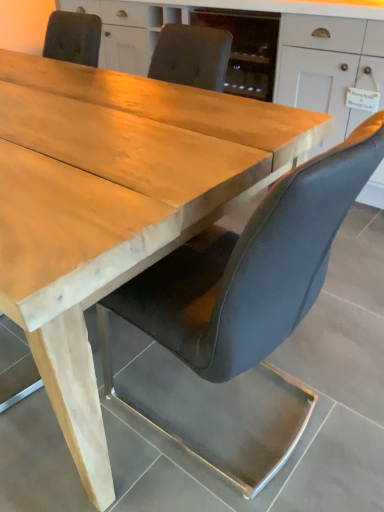
Consider the image. Measure the distance between point (286, 322) and camera.

The distance of point (286, 322) from camera is 92.40 centimeters.

This screenshot has width=384, height=512. Describe the element at coordinates (240, 285) in the screenshot. I see `leather-like black chair at center` at that location.

The height and width of the screenshot is (512, 384). In order to click on leather-like black chair at center in this screenshot , I will do `click(240, 285)`.

Where is `matte white cabinet at upper center`? This screenshot has width=384, height=512. matte white cabinet at upper center is located at coordinates (327, 67).

The height and width of the screenshot is (512, 384). What do you see at coordinates (327, 67) in the screenshot?
I see `matte white cabinet at upper center` at bounding box center [327, 67].

Locate an element on the screen. Image resolution: width=384 pixels, height=512 pixels. leather-like black chair at center is located at coordinates (240, 285).

Considering the relative positions of matte white cabinet at upper center and leather-like black chair at center in the image provided, is matte white cabinet at upper center to the right of leather-like black chair at center from the viewer's perspective?

Indeed, matte white cabinet at upper center is positioned on the right side of leather-like black chair at center.

Which is behind, matte white cabinet at upper center or leather-like black chair at center?

matte white cabinet at upper center is behind.

Does point (299, 55) lie in front of point (176, 266)?

That is False.

From the image's perspective, is matte white cabinet at upper center located beneath leather-like black chair at center?

Incorrect, from the image's perspective, matte white cabinet at upper center is higher than leather-like black chair at center.

From a real-world perspective, which is physically below, matte white cabinet at upper center or leather-like black chair at center?

In real-world perspective, leather-like black chair at center is lower.

Which object is wider, matte white cabinet at upper center or leather-like black chair at center?

matte white cabinet at upper center is wider.

Does matte white cabinet at upper center have a lesser height compared to leather-like black chair at center?

Incorrect, the height of matte white cabinet at upper center does not fall short of that of leather-like black chair at center.

Considering the sizes of objects matte white cabinet at upper center and leather-like black chair at center in the image provided, who is smaller, matte white cabinet at upper center or leather-like black chair at center?

With smaller size is leather-like black chair at center.

Would you say matte white cabinet at upper center is outside leather-like black chair at center?

That's correct, matte white cabinet at upper center is outside of leather-like black chair at center.

Is matte white cabinet at upper center placed right next to leather-like black chair at center?

No, matte white cabinet at upper center is not touching leather-like black chair at center.

Is matte white cabinet at upper center positioned with its back to leather-like black chair at center?

matte white cabinet at upper center does not have its back to leather-like black chair at center.

How distant is matte white cabinet at upper center from leather-like black chair at center?

They are 4.26 feet apart.

You are a GUI agent. You are given a task and a screenshot of the screen. Output one action in this format:
    pyautogui.click(x=<x>, y=<y>)
    Task: Click on the chair in front of the matte white cabinet at upper center
    
    Given the screenshot: What is the action you would take?
    pyautogui.click(x=240, y=285)

Considering the relative positions of leather-like black chair at center and matte white cabinet at upper center in the image provided, is leather-like black chair at center to the left of matte white cabinet at upper center from the viewer's perspective?

Correct, you'll find leather-like black chair at center to the left of matte white cabinet at upper center.

Is leather-like black chair at center behind matte white cabinet at upper center?

No, leather-like black chair at center is closer to the camera.

Does point (175, 278) come farther from viewer compared to point (379, 61)?

No, (175, 278) is in front of (379, 61).

From the image's perspective, does leather-like black chair at center appear higher than matte white cabinet at upper center?

No, from the image's perspective, leather-like black chair at center is not above matte white cabinet at upper center.

From a real-world perspective, is leather-like black chair at center on matte white cabinet at upper center?

No, from a real-world perspective, leather-like black chair at center is not on top of matte white cabinet at upper center.

Looking at their sizes, would you say leather-like black chair at center is wider or thinner than matte white cabinet at upper center?

leather-like black chair at center is thinner than matte white cabinet at upper center.

Considering the relative sizes of leather-like black chair at center and matte white cabinet at upper center in the image provided, is leather-like black chair at center taller than matte white cabinet at upper center?

No, leather-like black chair at center is not taller than matte white cabinet at upper center.

Does leather-like black chair at center have a smaller size compared to matte white cabinet at upper center?

Yes.

Based on the photo, is leather-like black chair at center spatially inside matte white cabinet at upper center, or outside of it?

leather-like black chair at center exists outside the volume of matte white cabinet at upper center.

Is leather-like black chair at center far from matte white cabinet at upper center?

Yes, leather-like black chair at center and matte white cabinet at upper center are quite far apart.

Is leather-like black chair at center looking in the opposite direction of matte white cabinet at upper center?

leather-like black chair at center is not turned away from matte white cabinet at upper center.

Based on the photo, measure the distance from leather-like black chair at center to matte white cabinet at upper center.

The distance of leather-like black chair at center from matte white cabinet at upper center is 4.26 feet.

Where is `cabinetry behind the leather-like black chair at center`? This screenshot has width=384, height=512. cabinetry behind the leather-like black chair at center is located at coordinates (327, 67).

Find the location of a particular element. Image resolution: width=384 pixels, height=512 pixels. cabinetry located on the right of leather-like black chair at center is located at coordinates (327, 67).

Identify the location of chair below the matte white cabinet at upper center (from the image's perspective). 240,285.